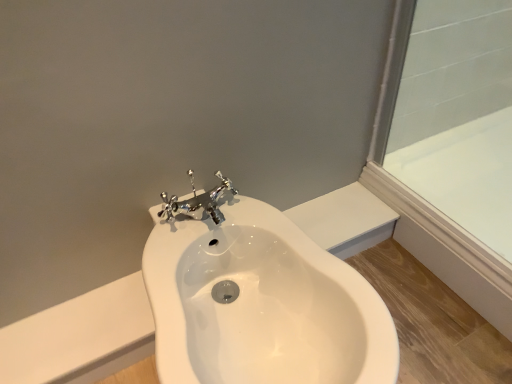
Question: From the image's perspective, relative to white glossy sink at center, is white glossy bathtub at upper right above or below?

Choices:
 (A) above
 (B) below

Answer: (A)

Question: From their relative heights in the image, would you say white glossy bathtub at upper right is taller or shorter than white glossy sink at center?

Choices:
 (A) short
 (B) tall

Answer: (A)

Question: Considering the positions of white glossy bathtub at upper right and white glossy sink at center in the image, is white glossy bathtub at upper right bigger or smaller than white glossy sink at center?

Choices:
 (A) small
 (B) big

Answer: (A)

Question: In terms of size, does white glossy sink at center appear bigger or smaller than white glossy bathtub at upper right?

Choices:
 (A) small
 (B) big

Answer: (B)

Question: Is white glossy sink at center to the left or to the right of white glossy bathtub at upper right in the image?

Choices:
 (A) left
 (B) right

Answer: (A)

Question: From a real-world perspective, relative to white glossy bathtub at upper right, is white glossy sink at center vertically above or below?

Choices:
 (A) below
 (B) above

Answer: (B)

Question: In the image, is white glossy sink at center positioned in front of or behind white glossy bathtub at upper right?

Choices:
 (A) front
 (B) behind

Answer: (A)